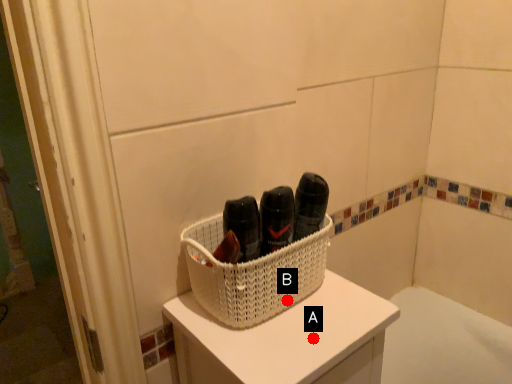
Question: Two points are circled on the image, labeled by A and B beside each circle. Which point is farther to the camera?

Choices:
 (A) A is further
 (B) B is further

Answer: (B)